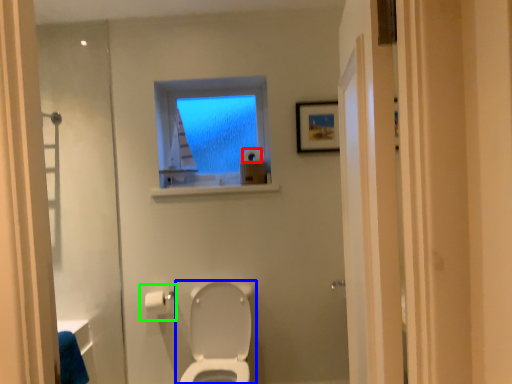
Question: Based on their relative distances, which object is nearer to toilet paper (highlighted by a red box)? Choose from toilet (highlighted by a blue box) and toilet paper (highlighted by a green box).

Choices:
 (A) toilet
 (B) toilet paper

Answer: (B)